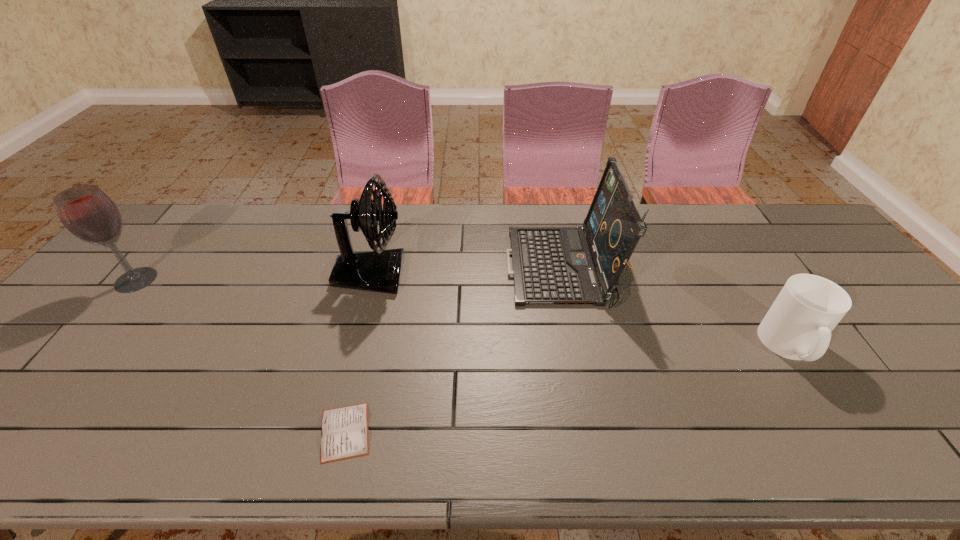
What are the coordinates of `free region at the right edge of the desktop` in the screenshot? It's located at (870, 288).

This screenshot has width=960, height=540. I want to click on free spot between the nearest object and the fourth tallest object, so click(567, 389).

This screenshot has width=960, height=540. I want to click on free area in between the shortest object and the second nearest object, so click(x=567, y=389).

This screenshot has width=960, height=540. What are the coordinates of `vacant area that lies between the fan and the shortest object` in the screenshot? It's located at (358, 353).

Identify the location of free space between the fan and the fourth tallest object. The image size is (960, 540). (581, 310).

Where is `vacant point located between the mug and the alcohol`? This screenshot has width=960, height=540. vacant point located between the mug and the alcohol is located at coordinates (463, 313).

Where is `free spot between the rightmost object and the second object from right to left`? This screenshot has height=540, width=960. free spot between the rightmost object and the second object from right to left is located at coordinates (675, 308).

This screenshot has width=960, height=540. I want to click on vacant space in between the shortest object and the fourth tallest object, so click(567, 389).

Point out which object is positioned as the second nearest to the fourth farthest object. Please provide its 2D coordinates. Your answer should be formatted as a tuple, i.e. [(x, y)], where the tuple contains the x and y coordinates of a point satisfying the conditions above.

[(379, 270)]

Choose which object is the nearest neighbor to the alcohol. Please provide its 2D coordinates. Your answer should be formatted as a tuple, i.e. [(x, y)], where the tuple contains the x and y coordinates of a point satisfying the conditions above.

[(379, 270)]